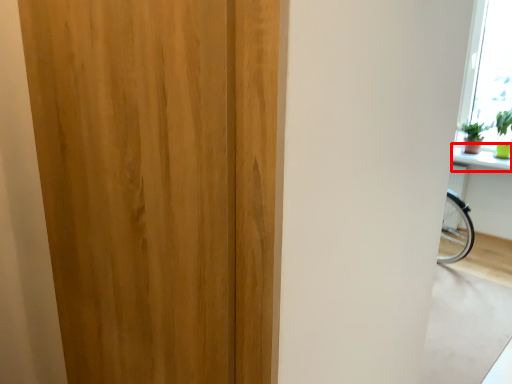
Question: From the image's perspective, where is window sill (annotated by the red box) located in relation to door in the image?

Choices:
 (A) below
 (B) above

Answer: (B)